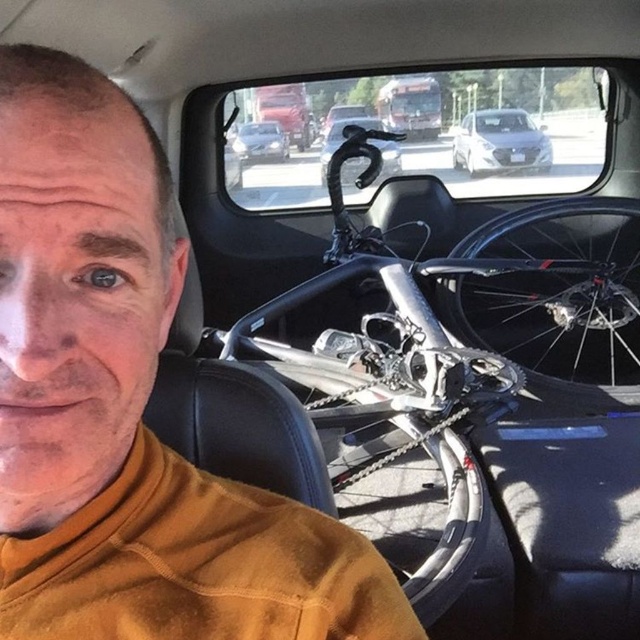
Does silver metallic bicycle at center appear on the left side of shiny black bicycle handlebar at center?

Incorrect, silver metallic bicycle at center is not on the left side of shiny black bicycle handlebar at center.

Does silver metallic bicycle at center have a smaller size compared to shiny black bicycle handlebar at center?

Incorrect, silver metallic bicycle at center is not smaller in size than shiny black bicycle handlebar at center.

Find the location of a particular element. silver metallic bicycle at center is located at coordinates (422, 365).

Who is lower down, white glossy sedan at upper center or brushed metal bus at upper center?

white glossy sedan at upper center is lower down.

Is white glossy sedan at upper center above brushed metal bus at upper center?

No.

Locate an element on the screen. The width and height of the screenshot is (640, 640). white glossy sedan at upper center is located at coordinates (499, 141).

You are a GUI agent. You are given a task and a screenshot of the screen. Output one action in this format:
    pyautogui.click(x=<x>, y=<y>)
    Task: Click on the silver metallic bicycle at center
    The image size is (640, 640).
    Given the screenshot: What is the action you would take?
    pyautogui.click(x=422, y=365)

Can you confirm if silver metallic bicycle at center is bigger than matte silver sedan at center?

Yes, silver metallic bicycle at center is bigger than matte silver sedan at center.

The height and width of the screenshot is (640, 640). What do you see at coordinates (422, 365) in the screenshot?
I see `silver metallic bicycle at center` at bounding box center [422, 365].

You are a GUI agent. You are given a task and a screenshot of the screen. Output one action in this format:
    pyautogui.click(x=<x>, y=<y>)
    Task: Click on the silver metallic bicycle at center
    Image resolution: width=640 pixels, height=640 pixels.
    Given the screenshot: What is the action you would take?
    pyautogui.click(x=422, y=365)